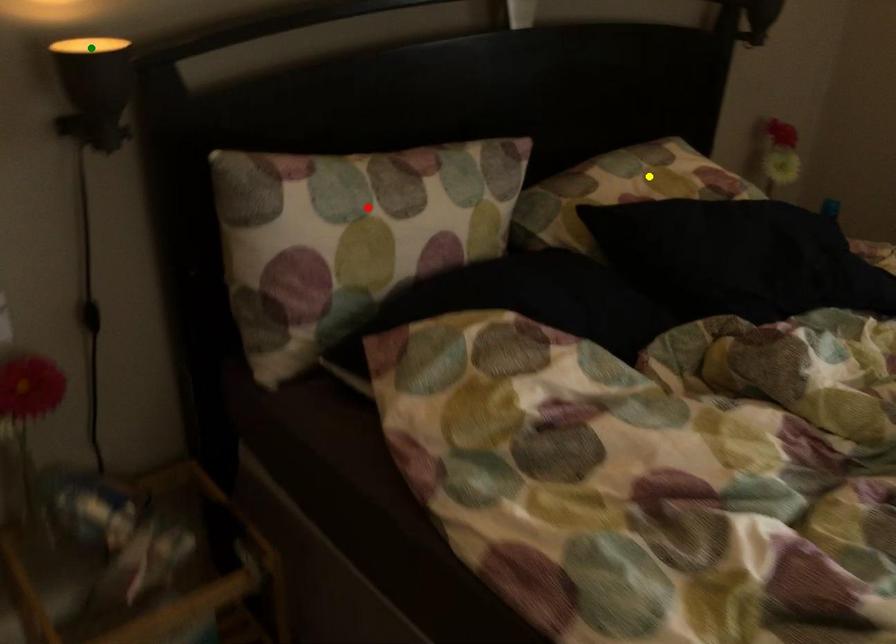
Order these from nearest to farthest:
A) red point
B) yellow point
C) green point

green point, red point, yellow point